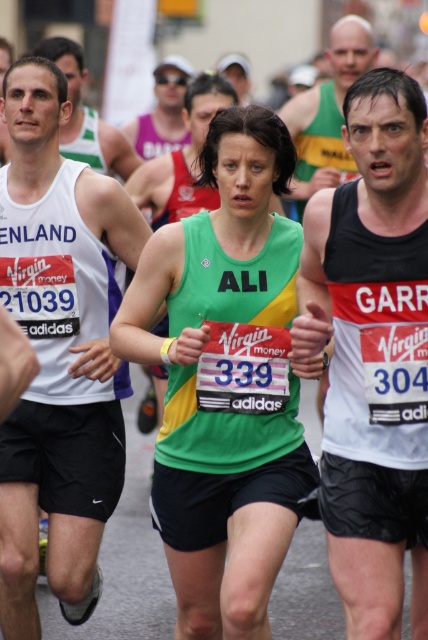
You are a race official at the marathon and need to determine the current positions of the runners. Based on the image, which runner is closer to the camera, the green jersey at center or the white tank top at center?

The green jersey at center is closer to the camera because the white tank top at center is behind it.